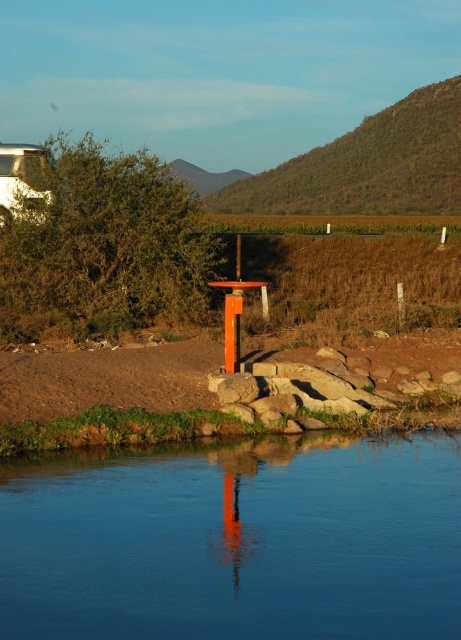
Question: Can you confirm if transparent glass river at center is positioned below green leafy hillside at upper center?

Choices:
 (A) no
 (B) yes

Answer: (B)

Question: Which point is closer to the camera?

Choices:
 (A) transparent glass river at center
 (B) green leafy hillside at upper center

Answer: (A)

Question: Can you confirm if transparent glass river at center is positioned above green leafy hillside at upper center?

Choices:
 (A) no
 (B) yes

Answer: (A)

Question: Which object is farther from the camera taking this photo?

Choices:
 (A) transparent glass river at center
 (B) green leafy hillside at upper center

Answer: (B)

Question: Which point is farther to the camera?

Choices:
 (A) green leafy hillside at upper center
 (B) transparent glass river at center

Answer: (A)

Question: Can you confirm if transparent glass river at center is positioned above green leafy hillside at upper center?

Choices:
 (A) yes
 (B) no

Answer: (B)